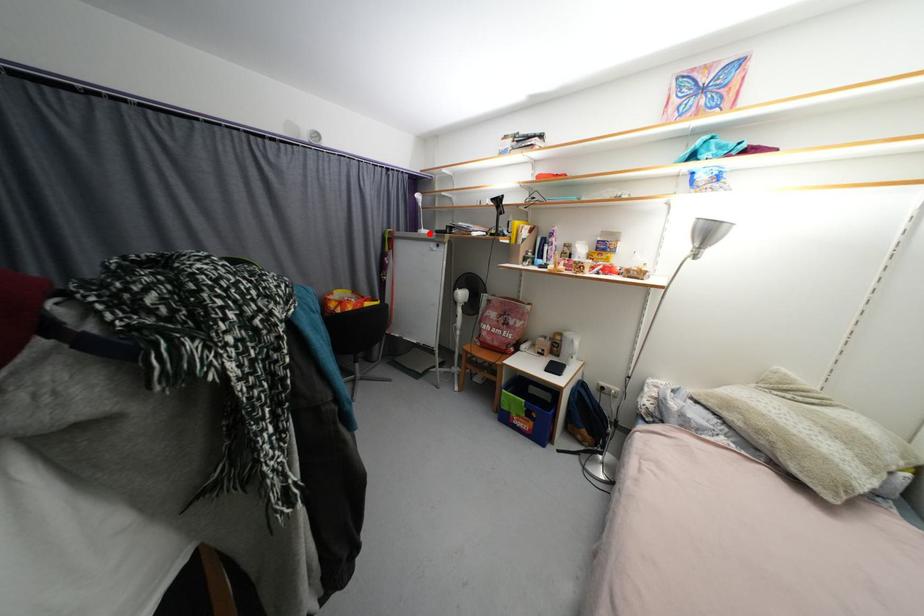
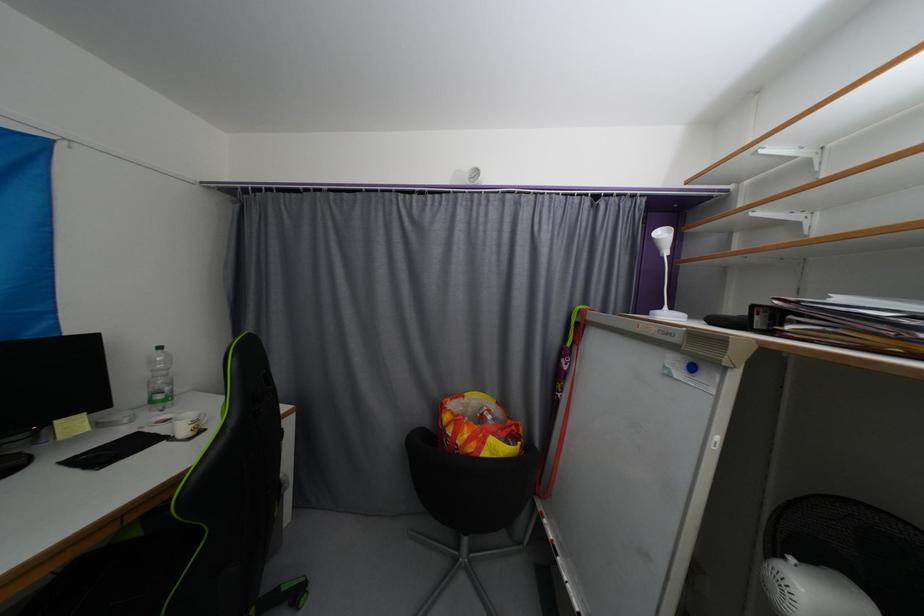
The point at the highlighted location is marked in the first image. Where is the corresponding point in the second image?

(672, 317)